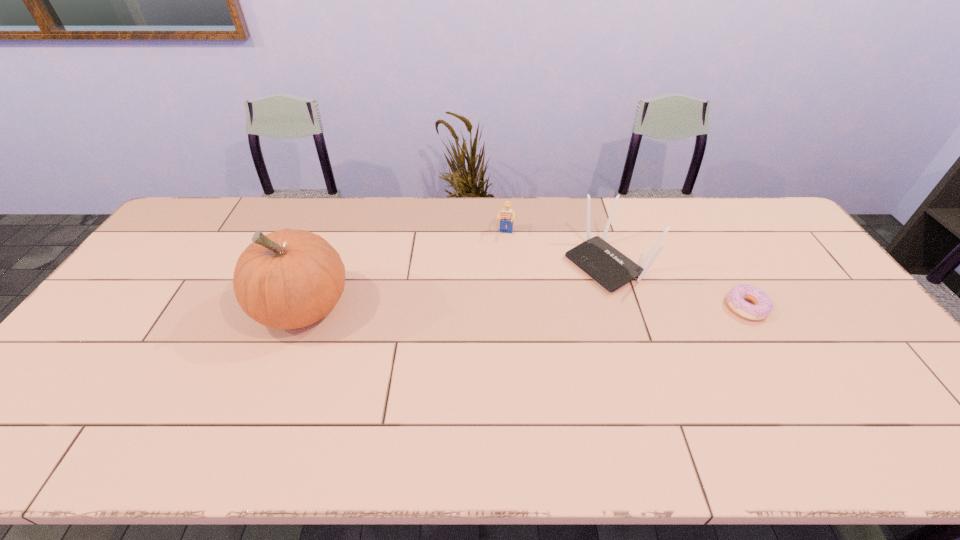
This screenshot has width=960, height=540. I want to click on vacant space that is in between the tallest object and the Lego, so coord(404,271).

Where is `empty location between the third tallest object and the pumpkin`? Image resolution: width=960 pixels, height=540 pixels. empty location between the third tallest object and the pumpkin is located at coordinates (404, 271).

Identify the location of vacant space that is in between the router and the rightmost object. This screenshot has height=540, width=960. (678, 286).

Find the location of a particular element. The width and height of the screenshot is (960, 540). vacant area between the leftmost object and the shortest object is located at coordinates (524, 307).

Identify which object is the second closest to the tallest object. Please provide its 2D coordinates. Your answer should be formatted as a tuple, i.e. [(x, y)], where the tuple contains the x and y coordinates of a point satisfying the conditions above.

[(611, 269)]

Locate an element on the screen. The width and height of the screenshot is (960, 540). object that can be found as the closest to the tallest object is located at coordinates (507, 216).

Image resolution: width=960 pixels, height=540 pixels. I want to click on vacant space that satisfies the following two spatial constraints: 1. on the front side of the third shortest object; 2. on the right side of the shortest object, so click(x=622, y=307).

The width and height of the screenshot is (960, 540). In order to click on free point that satisfies the following two spatial constraints: 1. on the front side of the doughnut; 2. on the right side of the router in this screenshot , I will do `click(622, 307)`.

Find the location of `free spot that satisfies the following two spatial constraints: 1. on the front side of the third shortest object; 2. on the left side of the Lego`. free spot that satisfies the following two spatial constraints: 1. on the front side of the third shortest object; 2. on the left side of the Lego is located at coordinates (507, 264).